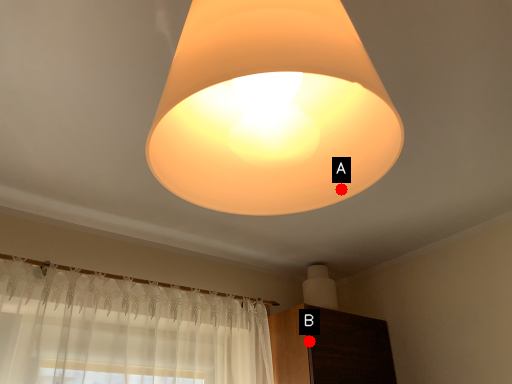
Question: Two points are circled on the image, labeled by A and B beside each circle. Which of the following is the farthest from the observer?

Choices:
 (A) A is further
 (B) B is further

Answer: (B)